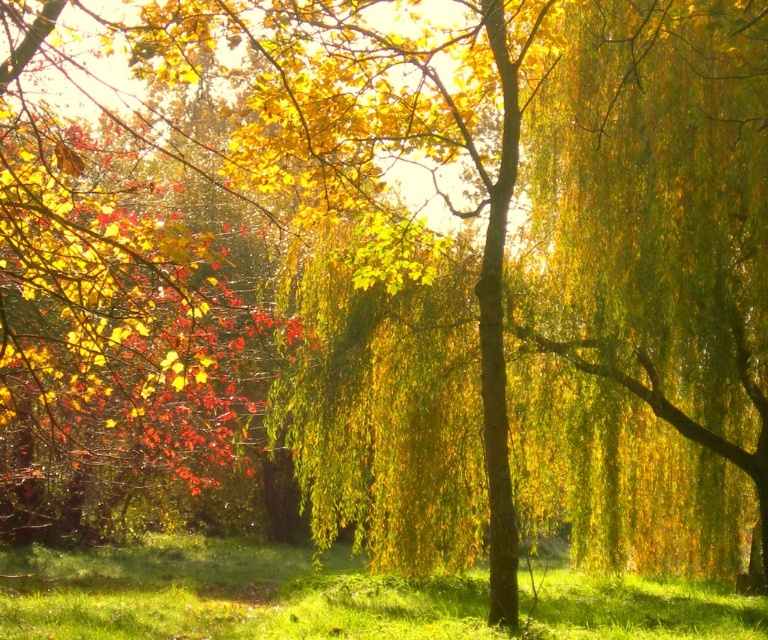
Question: Which of the following is the closest to the observer?

Choices:
 (A) green grass at lower center
 (B) golden silky willow at right

Answer: (B)

Question: Which of the following is the closest to the observer?

Choices:
 (A) (651, 356)
 (B) (270, 593)

Answer: (A)

Question: Which point is farther from the camera taking this photo?

Choices:
 (A) (159, 573)
 (B) (753, 148)

Answer: (A)

Question: Can you confirm if golden silky willow at right is smaller than green grass at lower center?

Choices:
 (A) yes
 (B) no

Answer: (B)

Question: Does golden silky willow at right lie behind green grass at lower center?

Choices:
 (A) yes
 (B) no

Answer: (B)

Question: Can you confirm if golden silky willow at right is positioned to the right of green grass at lower center?

Choices:
 (A) no
 (B) yes

Answer: (B)